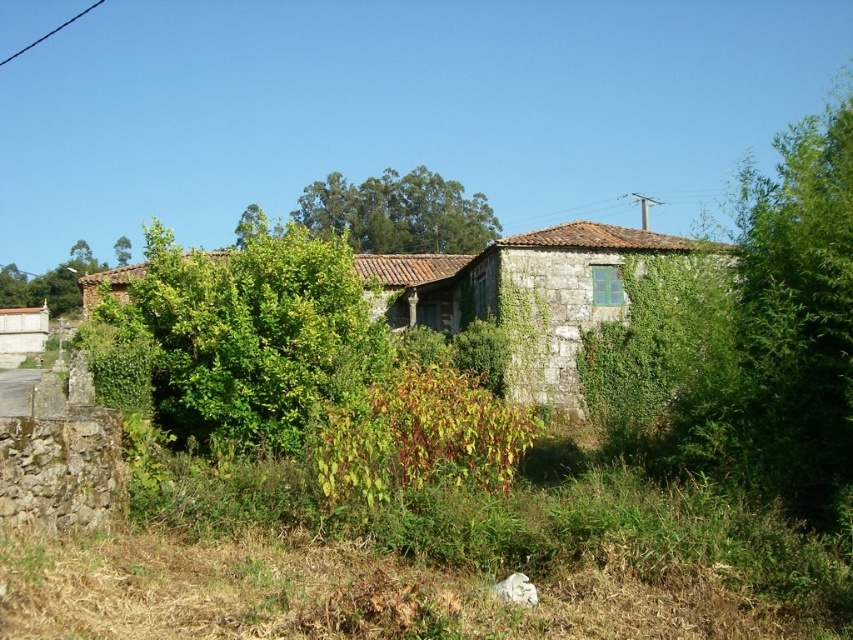
You are standing in the rural scene and want to walk from the green leafy bush at center to the white concrete shed at lower left. Which direction should you move to get closer to the shed?

Since the green leafy bush at center is closer to the viewer than the white concrete shed at lower left, you should move backward to get closer to the white concrete shed at lower left.